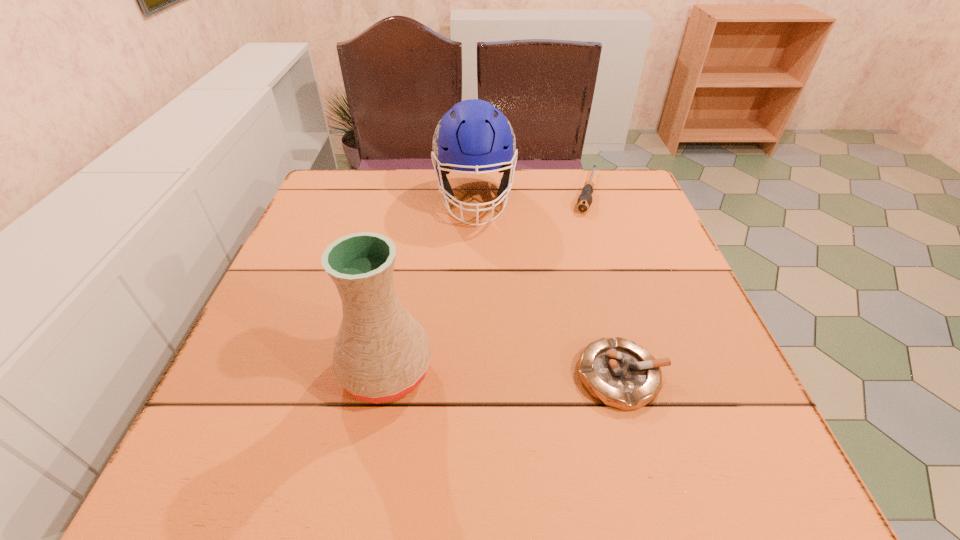
The width and height of the screenshot is (960, 540). In order to click on unoccupied area between the football helmet and the pottery in this screenshot , I will do `click(431, 285)`.

Identify the location of free space between the ashtray and the screwdriver. (604, 284).

Where is `free point between the pottery and the ashtray`? Image resolution: width=960 pixels, height=540 pixels. free point between the pottery and the ashtray is located at coordinates (504, 373).

Identify the location of free spot between the pottery and the football helmet. (431, 285).

At what (x,y) coordinates should I click in order to perform the action: click on vacant area that lies between the screwdriver and the football helmet. Please return your answer as a coordinate pair (x, y). This screenshot has width=960, height=540. Looking at the image, I should click on (531, 195).

I want to click on object that is the closest to the pottery, so click(x=618, y=372).

The image size is (960, 540). I want to click on object identified as the second closest to the ashtray, so (473, 135).

I want to click on free spot that satisfies the following two spatial constraints: 1. on the front side of the ashtray; 2. on the right side of the pottery, so click(x=386, y=375).

The image size is (960, 540). Identify the location of vacant space that satisfies the following two spatial constraints: 1. on the back side of the screwdriver; 2. on the right side of the pottery. (420, 192).

Locate an element on the screen. Image resolution: width=960 pixels, height=540 pixels. free location that satisfies the following two spatial constraints: 1. on the front side of the ashtray; 2. on the right side of the pottery is located at coordinates (386, 375).